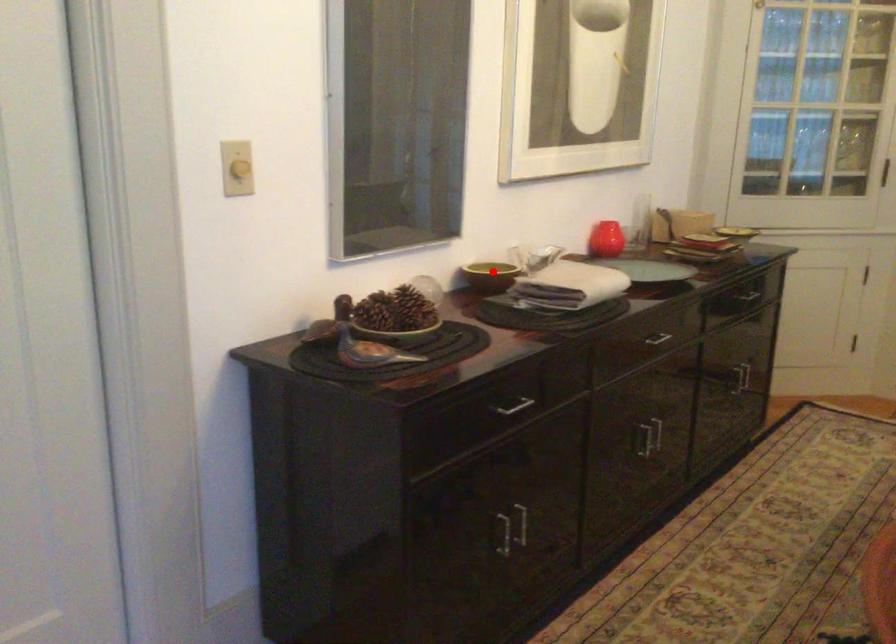
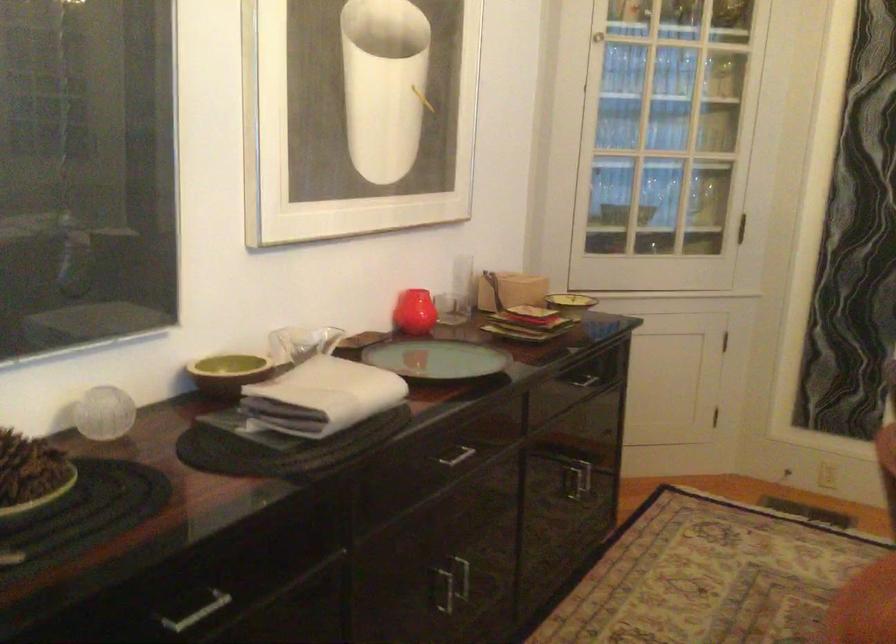
Locate, in the second image, the point that corresponds to the highlighted location in the first image.

(228, 373)